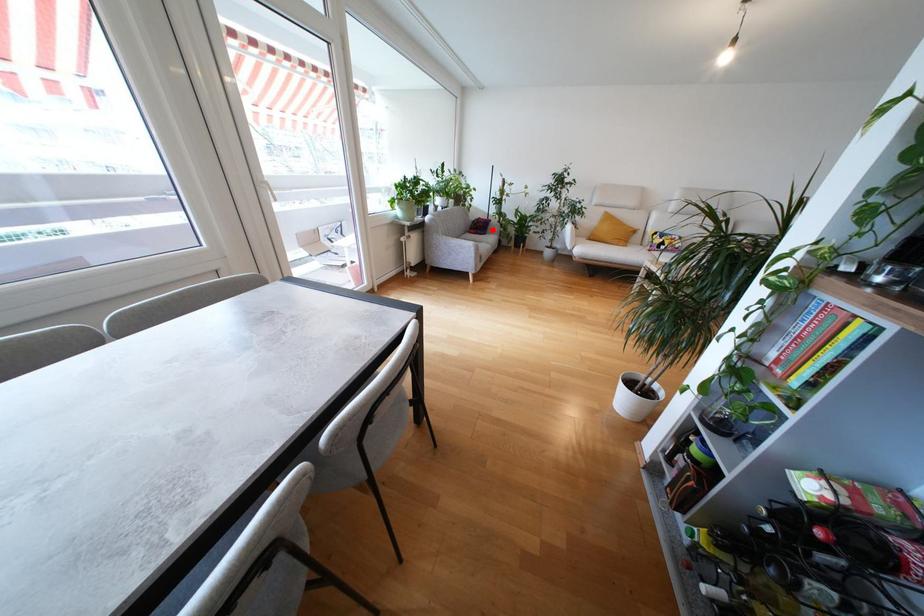
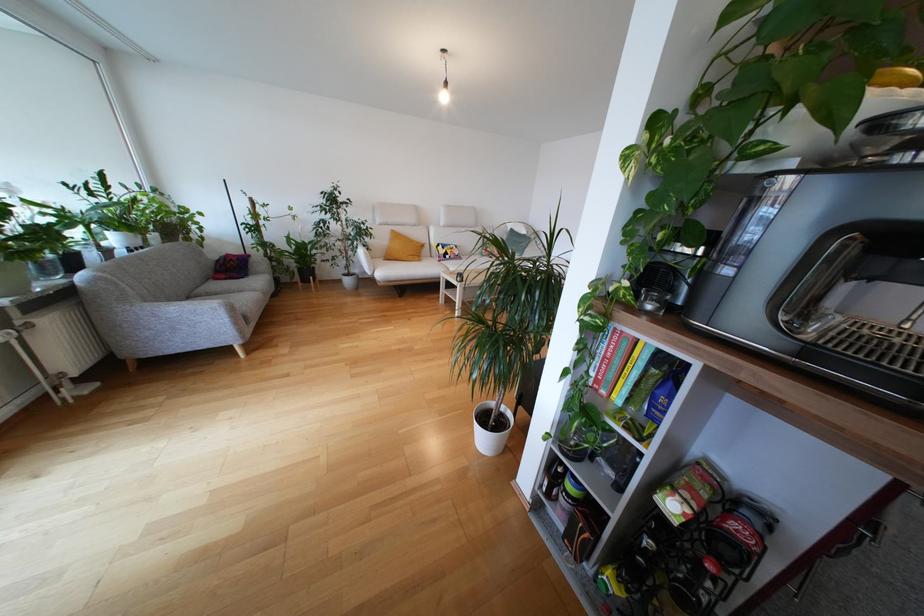
Question: I am providing you with two images of the same scene from different viewpoints. In image1, a red point is highlighted. Considering the same 3D point in image2, which of the following is correct?

Choices:
 (A) It is closer
 (B) It is farther

Answer: (A)